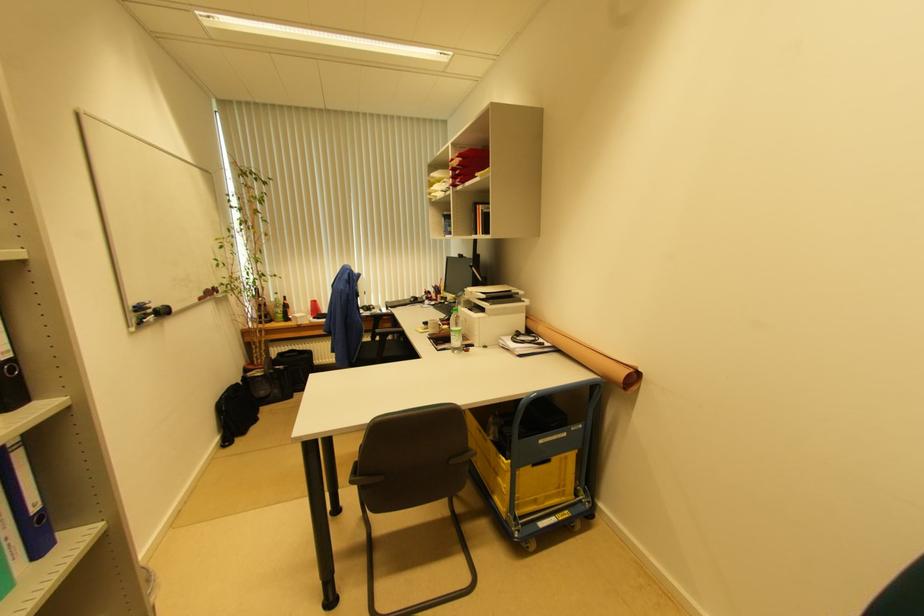
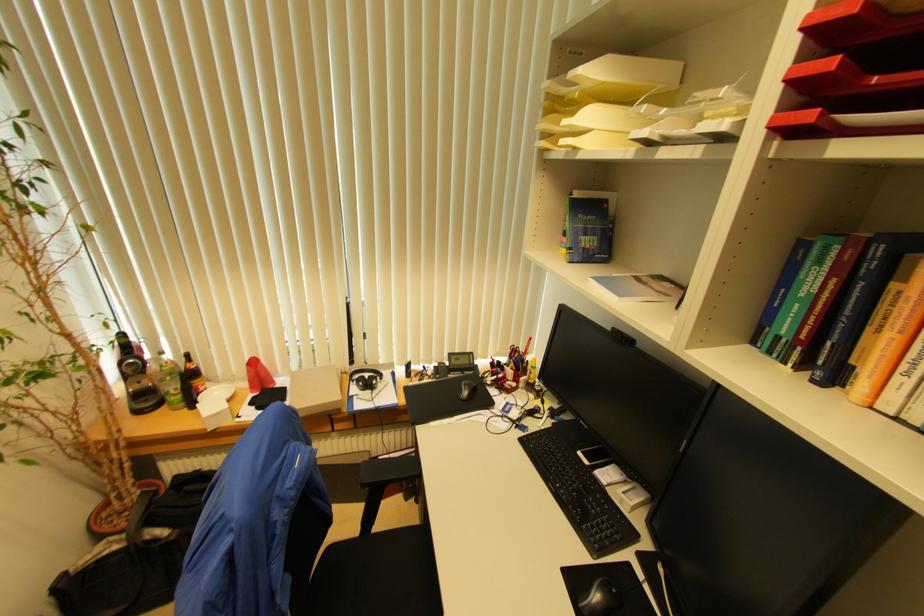
In the second image, find the point that corresponds to point (281, 315) in the first image.

(174, 394)